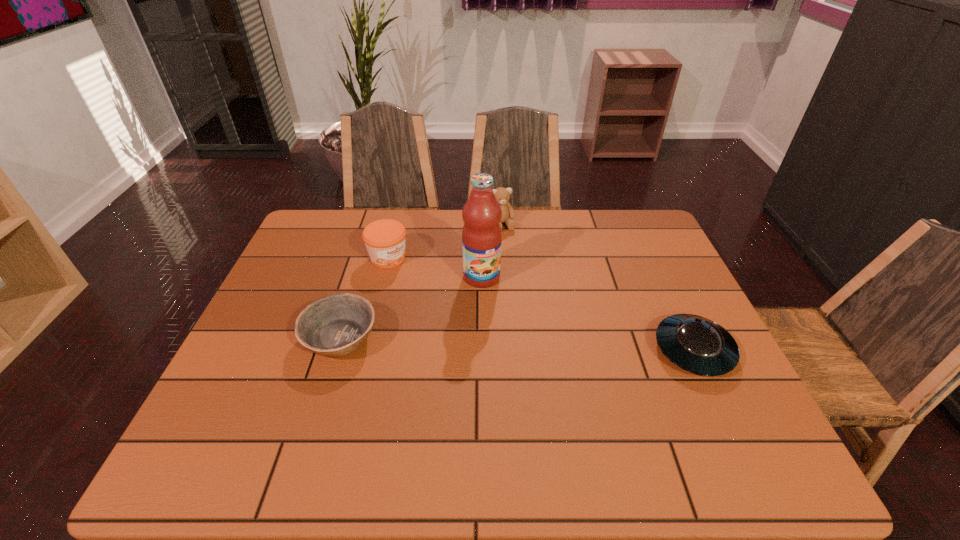
Locate an element on the screen. Image resolution: width=960 pixels, height=540 pixels. bowl is located at coordinates (335, 326).

Find the location of `the rightmost object`. the rightmost object is located at coordinates (696, 344).

I want to click on fruit juice, so click(x=481, y=235).

The width and height of the screenshot is (960, 540). I want to click on jam, so click(x=385, y=239).

Locate an element on the screen. teddy bear is located at coordinates (502, 194).

What are the coordinates of `the farthest object` in the screenshot? It's located at (502, 194).

You are a GUI agent. You are given a task and a screenshot of the screen. Output one action in this format:
    pyautogui.click(x=<x>, y=<y>)
    Task: Click on the vacant region located on the right of the bowl
    The width and height of the screenshot is (960, 540).
    Given the screenshot: What is the action you would take?
    pyautogui.click(x=447, y=339)

I want to click on free location located 0.170m on the back of the rightmost object, so click(660, 278).

This screenshot has height=540, width=960. What are the coordinates of `vacant space positioned 0.190m on the front label of the tallest object` in the screenshot? It's located at (514, 338).

Find the location of a particular element. Image resolution: width=960 pixels, height=540 pixels. vacant region located 0.050m on the front label of the tallest object is located at coordinates (494, 300).